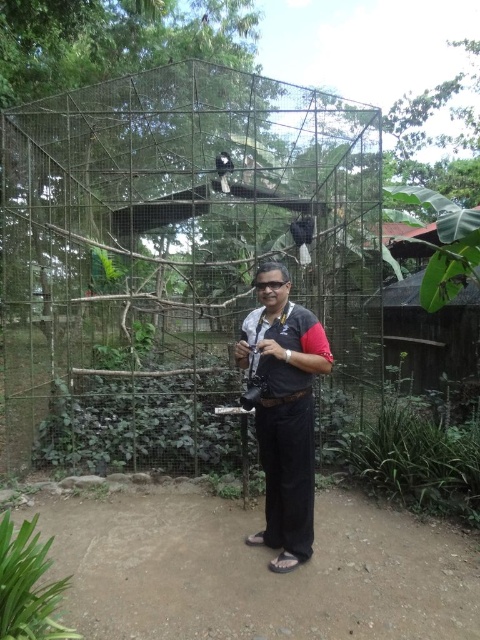
Question: Does metal mesh cage at center come behind black fabric shirt at center?

Choices:
 (A) no
 (B) yes

Answer: (B)

Question: Is metal mesh cage at center positioned behind black fabric shirt at center?

Choices:
 (A) no
 (B) yes

Answer: (B)

Question: Which object appears closest to the camera in this image?

Choices:
 (A) black fabric shirt at center
 (B) metal mesh cage at center

Answer: (A)

Question: Is the position of metal mesh cage at center more distant than that of black fabric shirt at center?

Choices:
 (A) no
 (B) yes

Answer: (B)

Question: Which object is closer to the camera taking this photo?

Choices:
 (A) black fabric shirt at center
 (B) metal mesh cage at center

Answer: (A)